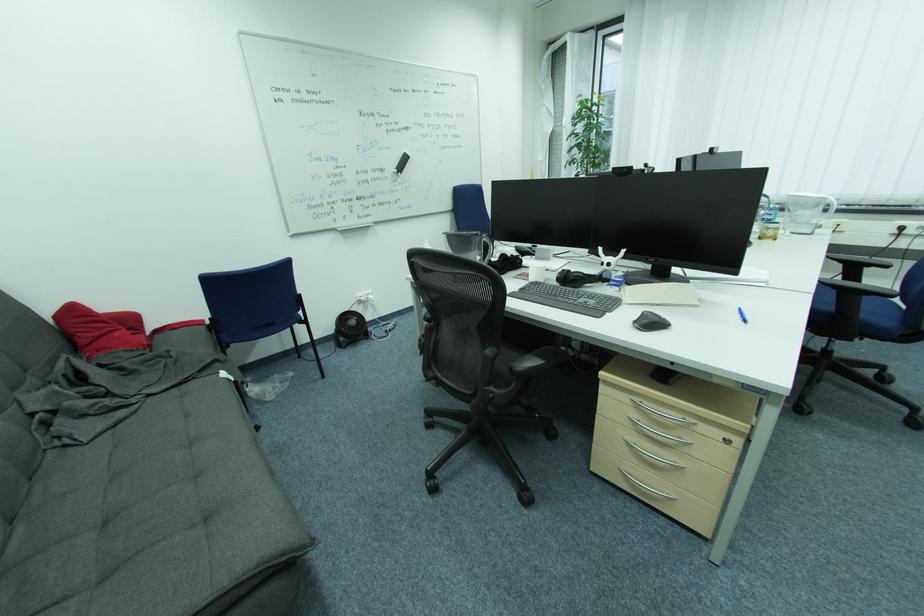
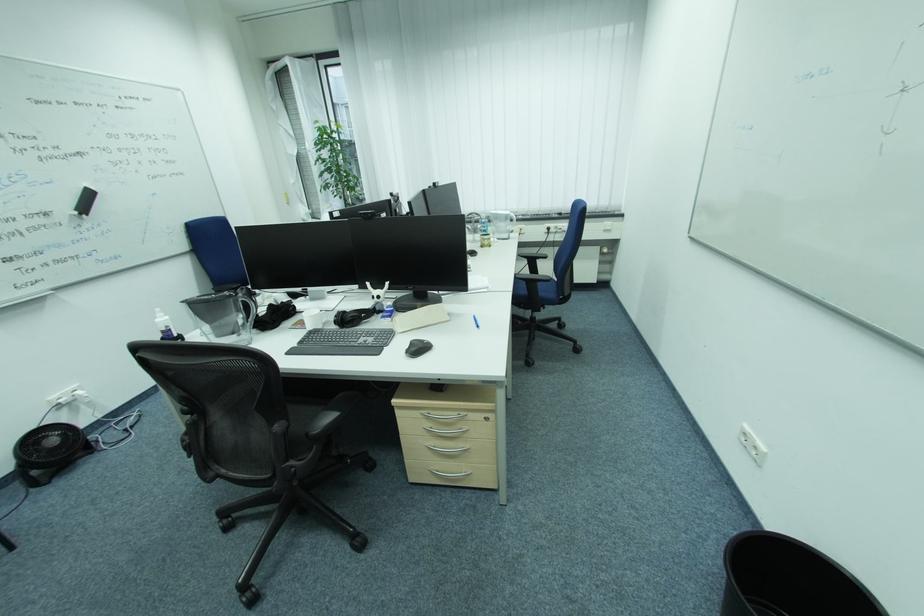
The point at (x=840, y=293) is marked in the first image. Where is the corresponding point in the second image?

(530, 284)